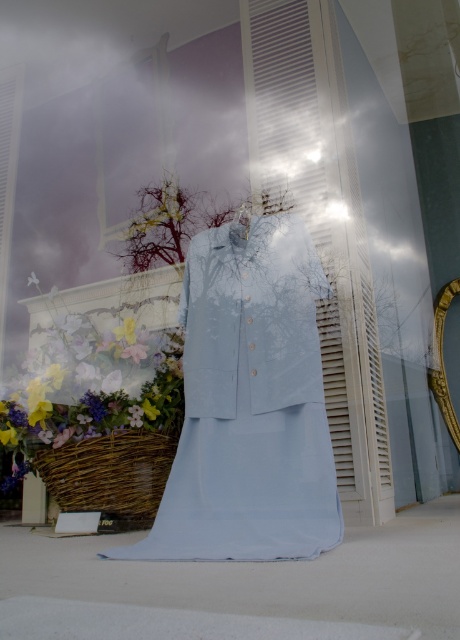
Question: Can you confirm if pastel floral bouquet at center is smaller than gold metallic mirror at right?

Choices:
 (A) yes
 (B) no

Answer: (B)

Question: Which of these objects is positioned closest to the woven brown basket at lower left?

Choices:
 (A) light blue fabric dress at center
 (B) gold metallic mirror at right
 (C) white matte flower at center

Answer: (A)

Question: Is light blue fabric shirt at center to the left of gold metallic mirror at right from the viewer's perspective?

Choices:
 (A) yes
 (B) no

Answer: (A)

Question: Which point is farther to the camera?

Choices:
 (A) (28, 276)
 (B) (437, 387)
 (C) (84, 371)

Answer: (B)

Question: Which of the following is the closest to the observer?

Choices:
 (A) (29, 282)
 (B) (69, 474)

Answer: (B)

Question: Is light blue fabric dress at center below light blue fabric shirt at center?

Choices:
 (A) yes
 (B) no

Answer: (A)